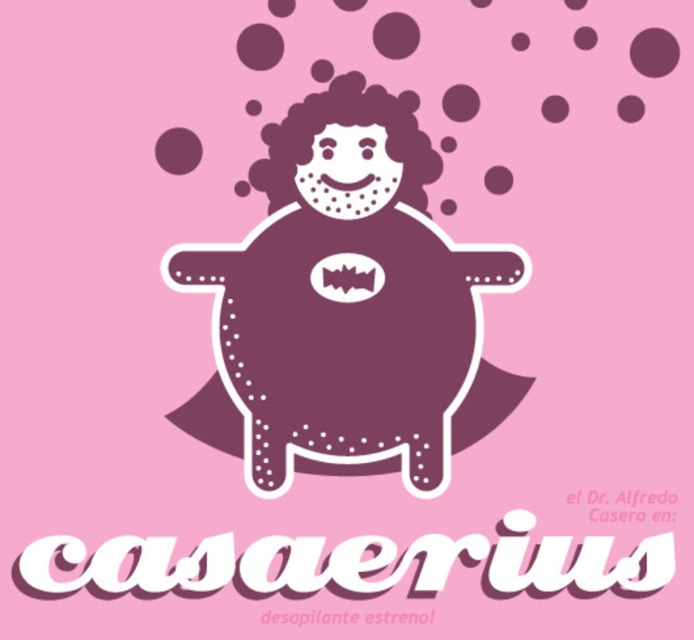
Looking at this image, you are designing a poster and need to ensure the purple dotted figure at center and the matte purple circle at center fit within a 10cm wide frame. Given their widths, which object might not fit if the frame is exactly 10cm wide?

The purple dotted figure at center has a greater width than the matte purple circle at center. If the frame is exactly 10cm wide, the purple dotted figure at center might not fit since it is wider than the matte purple circle at center.